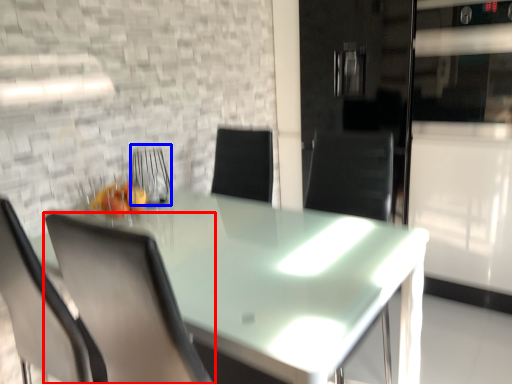
Question: Which object is further to the camera taking this photo, chair (highlighted by a red box) or armchair (highlighted by a blue box)?

Choices:
 (A) chair
 (B) armchair

Answer: (B)